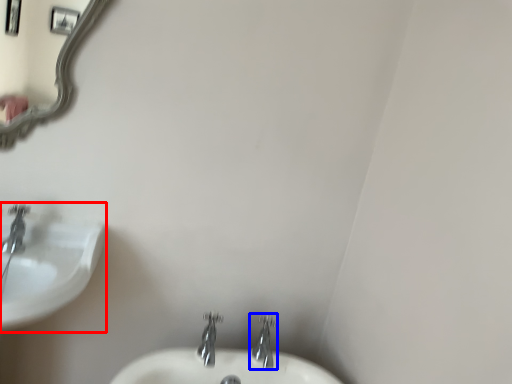
Question: Which object is further to the camera taking this photo, sink (highlighted by a red box) or tap (highlighted by a blue box)?

Choices:
 (A) sink
 (B) tap

Answer: (B)